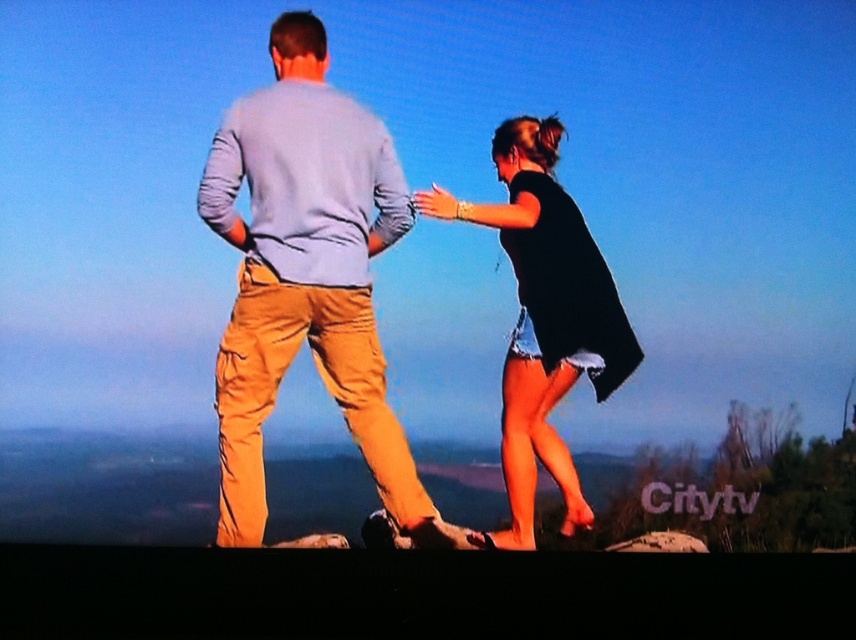
You are a photographer planning to take a group photo of the light blue cotton shirt at center and the black cotton dress at center. If you want to ensure both subjects are fully visible in the frame, which subject should you position closer to the camera to avoid cropping?

You should position the light blue cotton shirt at center closer to the camera because it might be wider than the black cotton dress at center, ensuring both fit within the frame without cropping.

You are a photographer planning to take a photo of the scene described. You need to ensure that the black cotton dress at center is positioned exactly at the center of the frame. Based on the coordinates provided, is the dress already centered in the image?

The black cotton dress at center is located at point (x=547, y=323), which is very close to the center coordinates of (x=428, y=320). However, since the coordinates are slightly offset, the dress is not perfectly centered in the image.